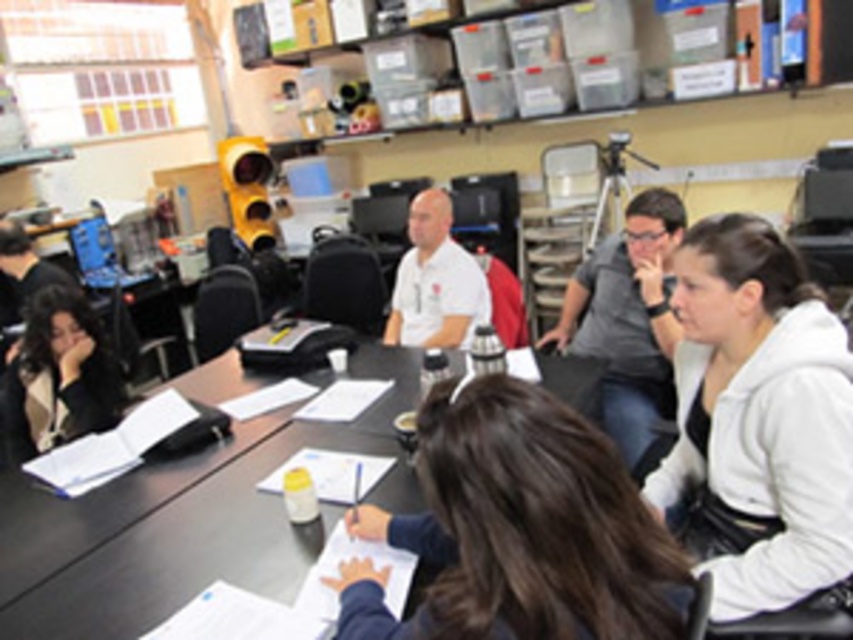
Question: Is white matte jacket at lower right positioned before gray matte shirt at center?

Choices:
 (A) no
 (B) yes

Answer: (B)

Question: Observing the image, what is the correct spatial positioning of white matte jacket at lower right in reference to black plastic table at center?

Choices:
 (A) left
 (B) right

Answer: (B)

Question: Among these points, which one is nearest to the camera?

Choices:
 (A) (96, 323)
 (B) (712, 237)
 (C) (502, 532)
 (D) (456, 342)

Answer: (C)

Question: Which object is closer to the camera taking this photo?

Choices:
 (A) black plastic table at center
 (B) white matte shirt at center
 (C) gray matte shirt at center
 (D) white matte jacket at lower right

Answer: (D)

Question: Which object is closer to the camera taking this photo?

Choices:
 (A) white matte jacket at lower right
 (B) white matte shirt at center

Answer: (A)

Question: Considering the relative positions of dark brown hair at center and beige textured jacket at lower left in the image provided, where is dark brown hair at center located with respect to beige textured jacket at lower left?

Choices:
 (A) below
 (B) above

Answer: (A)